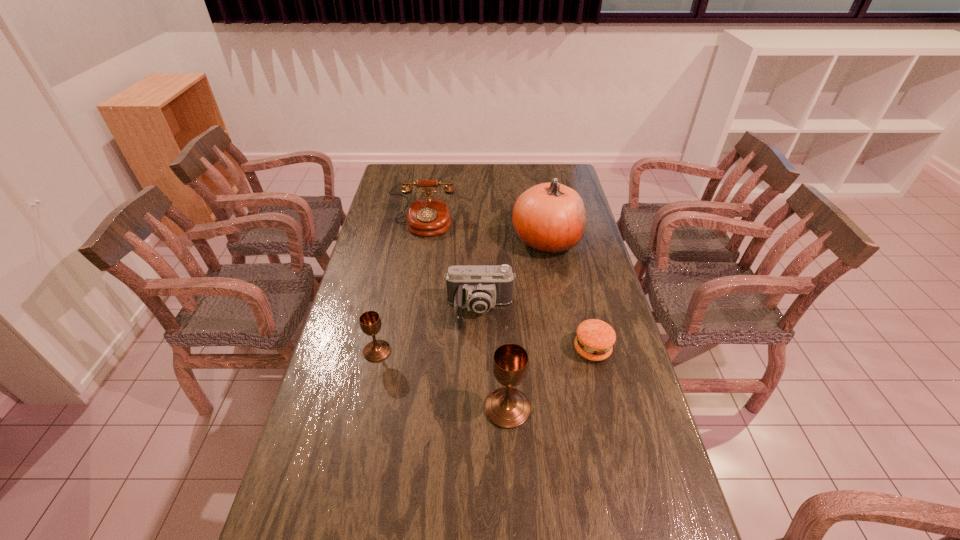
Locate an element on the screen. Image resolution: width=960 pixels, height=540 pixels. the shorter chalice is located at coordinates (370, 323).

Where is `the left chalice`? This screenshot has height=540, width=960. the left chalice is located at coordinates (370, 323).

The image size is (960, 540). In order to click on the right chalice in this screenshot , I will do `click(506, 407)`.

Image resolution: width=960 pixels, height=540 pixels. What are the coordinates of `the nearest object` in the screenshot? It's located at (506, 407).

Where is `pumpkin`? The height and width of the screenshot is (540, 960). pumpkin is located at coordinates (550, 218).

Locate an element on the screen. This screenshot has width=960, height=540. telephone is located at coordinates (429, 216).

Identify the location of patty. (595, 338).

Identify the location of camera. [479, 288].

You are a GUI agent. You are given a task and a screenshot of the screen. Output one action in this format:
    pyautogui.click(x=<x>, y=<y>)
    Task: Click on the vacant space located 0.050m on the left of the farther chalice
    The image size is (960, 540).
    Given the screenshot: What is the action you would take?
    coord(348,351)

Locate an element on the screen. The image size is (960, 540). vacant area situated 0.260m on the front of the nearest object is located at coordinates tap(514, 538).